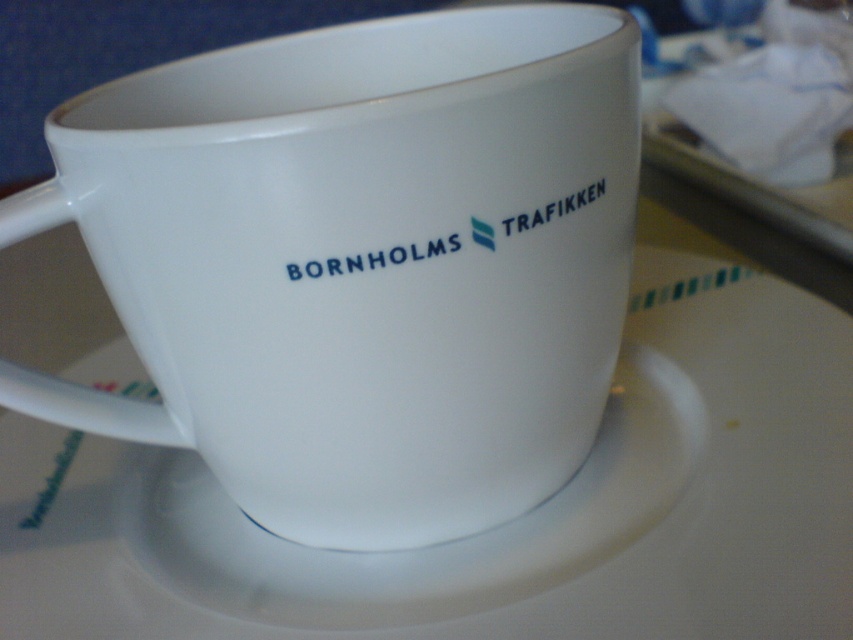
You are a barista working in a cafe. You need to place a customer order for a drink. The customer specified that the cup must be placed exactly at the center of the counter. Given the coordinates provided, is the white ceramic mug at center positioned correctly?

The white ceramic mug at center is located at coordinates point (358, 272), so it is positioned correctly at the center of the counter.

You are arranging items on a table and need to place both the white matte saucer at center and the white matte text at upper right. Based on the image, which object is located lower?

The white matte saucer at center is positioned under the white matte text at upper right, so the saucer is lower.